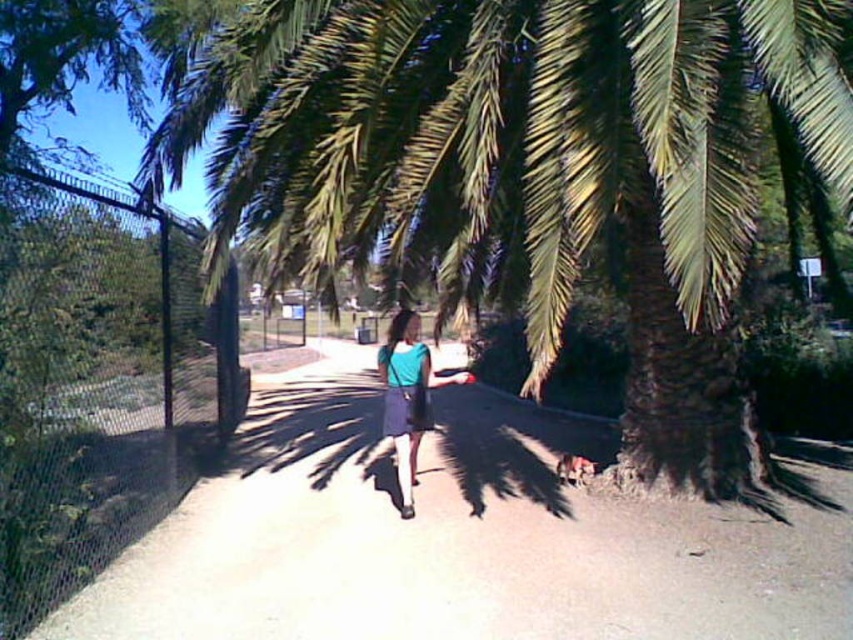
You are a hiker trying to follow the light brown dirt path at center. You notice a green leafy palm tree at center blocking your view. Can you see the path behind the palm tree at center?

The light brown dirt path at center is behind the green leafy palm tree at center, so you cannot see the path behind the palm tree at center because it is obstructed by the tree.